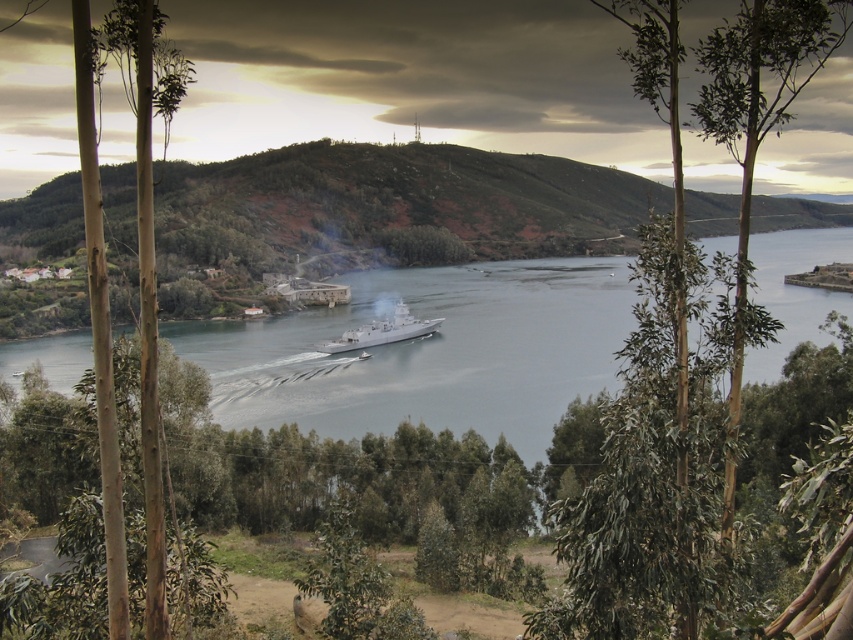
Question: Does green leafy tree at center appear under brown smooth tree trunk at left?

Choices:
 (A) no
 (B) yes

Answer: (A)

Question: Does green leafy tree at center lie in front of silver metallic ship at center?

Choices:
 (A) no
 (B) yes

Answer: (B)

Question: Which of the following is the farthest from the observer?

Choices:
 (A) silver metallic ship at center
 (B) brown smooth tree trunk at left
 (C) green leafy tree at center

Answer: (A)

Question: Is brown smooth tree trunk at left to the right of silver metallic ship at center from the viewer's perspective?

Choices:
 (A) yes
 (B) no

Answer: (A)

Question: Which object is farther from the camera taking this photo?

Choices:
 (A) green leafy tree at center
 (B) brown smooth tree trunk at left

Answer: (B)

Question: Which of the following is the closest to the observer?

Choices:
 (A) (73, 22)
 (B) (373, 340)
 (C) (585, 563)

Answer: (A)